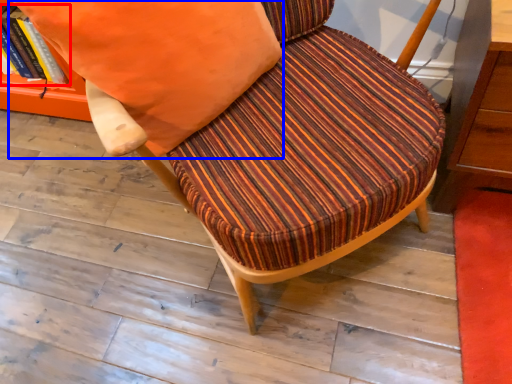
Question: Among these objects, which one is farthest to the camera, book (highlighted by a red box) or throw pillow (highlighted by a blue box)?

Choices:
 (A) book
 (B) throw pillow

Answer: (A)